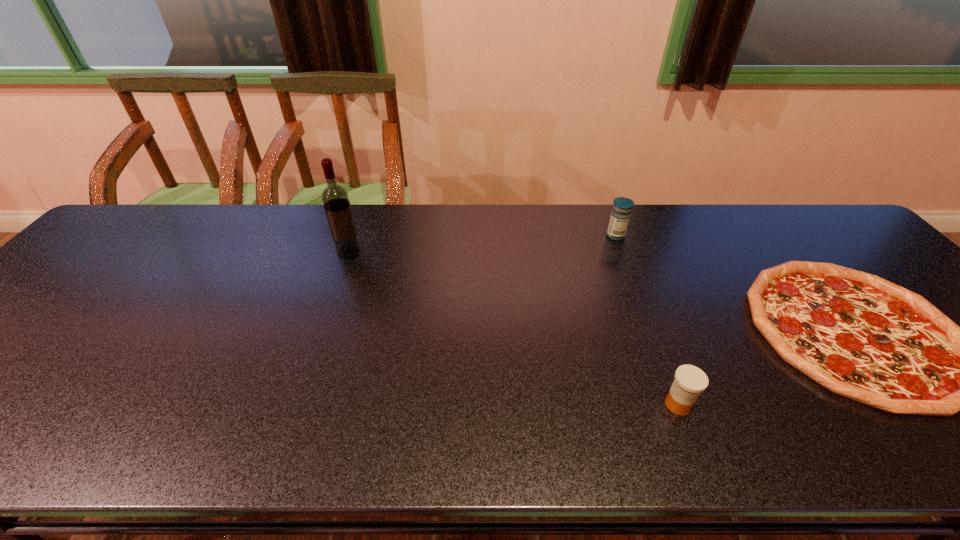
The width and height of the screenshot is (960, 540). Find the location of `the tallest object`. the tallest object is located at coordinates (335, 198).

You are a GUI agent. You are given a task and a screenshot of the screen. Output one action in this format:
    pyautogui.click(x=<x>, y=<y>)
    Task: Click on the leftmost object
    The height and width of the screenshot is (540, 960).
    Given the screenshot: What is the action you would take?
    pyautogui.click(x=335, y=198)

I want to click on the farther medicine, so click(620, 215).

Where is `the third shortest object`? The image size is (960, 540). the third shortest object is located at coordinates (620, 215).

Find the location of `the nearer medicine`. the nearer medicine is located at coordinates (690, 381).

Image resolution: width=960 pixels, height=540 pixels. In order to click on the third tallest object in this screenshot , I will do `click(690, 381)`.

Identify the location of vacant point located 0.350m on the front of the tallest object. This screenshot has width=960, height=540. (311, 360).

This screenshot has height=540, width=960. I want to click on free space located 0.390m on the right of the farthest object, so click(756, 235).

At what (x,y) coordinates should I click in order to perform the action: click on free space located on the label of the shorter medicine. Please return your answer as a coordinate pair (x, y). The width and height of the screenshot is (960, 540). Looking at the image, I should click on (600, 404).

Find the location of a particular element. vacant region located on the label of the shorter medicine is located at coordinates (546, 404).